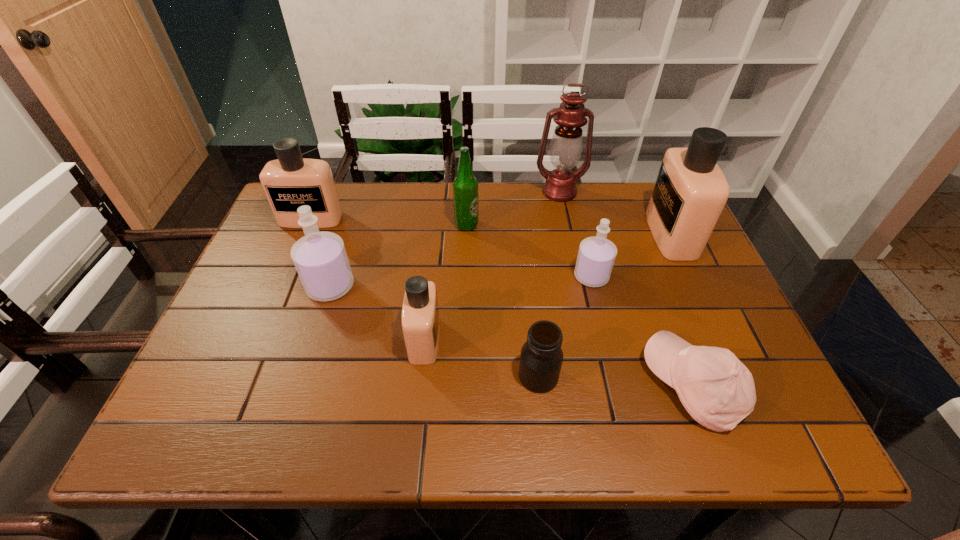
The height and width of the screenshot is (540, 960). I want to click on empty space between the farthest object and the jar, so click(x=549, y=284).

You are a GUI agent. You are given a task and a screenshot of the screen. Output one action in this format:
    pyautogui.click(x=<x>, y=<y>)
    Task: Click on the unoccupied position between the left purple perfume and the pink baseball cap
    The image size is (960, 540).
    Given the screenshot: What is the action you would take?
    pyautogui.click(x=512, y=336)

Locate which object ranks in proximity to the fourth perfume from left to right. Please provide its 2D coordinates. Your answer should be formatted as a tuple, i.e. [(x, y)], where the tuple contains the x and y coordinates of a point satisfying the conditions above.

[(690, 192)]

Where is `the seventh closest object to the baseball cap`? The width and height of the screenshot is (960, 540). the seventh closest object to the baseball cap is located at coordinates (320, 258).

Identify the location of perfume identified as the closest to the rightmost perfume. This screenshot has height=540, width=960. (596, 256).

I want to click on perfume that stands as the third closest to the red oil lamp, so click(x=420, y=315).

Locate which beige perfume ranks second in proximity to the second beige perfume from right to left. Please provide its 2D coordinates. Your answer should be formatted as a tuple, i.e. [(x, y)], where the tuple contains the x and y coordinates of a point satisfying the conditions above.

[(690, 192)]

Locate an element on the screen. This screenshot has width=960, height=540. beige perfume object that ranks as the closest to the green beer bottle is located at coordinates (420, 315).

The height and width of the screenshot is (540, 960). I want to click on vacant area in the image that satisfies the following two spatial constraints: 1. on the front label of the leftmost beige perfume; 2. on the left side of the bigger purple perfume, so click(x=282, y=287).